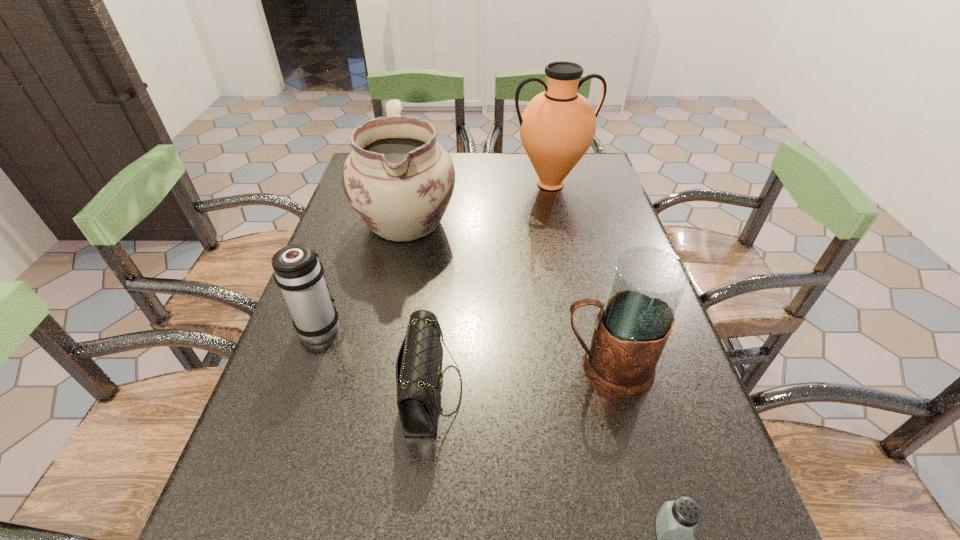
I want to click on the tallest object, so click(x=557, y=127).

Find the location of `the leftmost pitcher`. the leftmost pitcher is located at coordinates (398, 179).

Find the location of a particular element. The width and height of the screenshot is (960, 540). the nearest pitcher is located at coordinates (632, 327).

I want to click on the fourth tallest object, so click(297, 271).

Where is `clutch bag`? The height and width of the screenshot is (540, 960). clutch bag is located at coordinates (419, 363).

Locate an element on the screen. This screenshot has width=960, height=540. vacant space situated 0.080m on the left of the tallest pitcher is located at coordinates tap(485, 184).

I want to click on free space located 0.200m on the spout of the leftmost pitcher, so click(x=386, y=319).

Identify the location of free space located 0.210m with the handle on the side of the nearest pitcher. The image size is (960, 540). (453, 367).

The width and height of the screenshot is (960, 540). Find the location of `vacant space located 0.230m with the handle on the side of the nearest pitcher`. vacant space located 0.230m with the handle on the side of the nearest pitcher is located at coordinates (444, 367).

Locate an element on the screen. This screenshot has width=960, height=540. vacant position located with the handle on the side of the nearest pitcher is located at coordinates (363, 367).